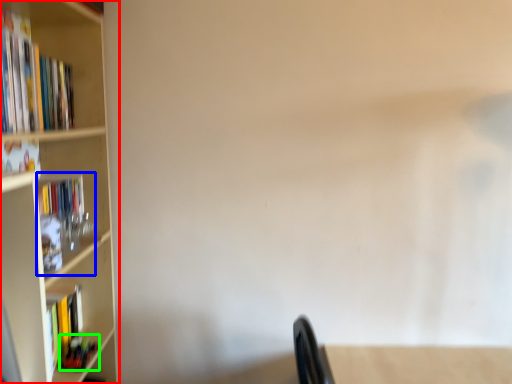
Question: Based on their relative distances, which object is farther from bookcase (highlighted by a red box)? Choose from book (highlighted by a blue box) and book (highlighted by a green box).

Choices:
 (A) book
 (B) book

Answer: (B)